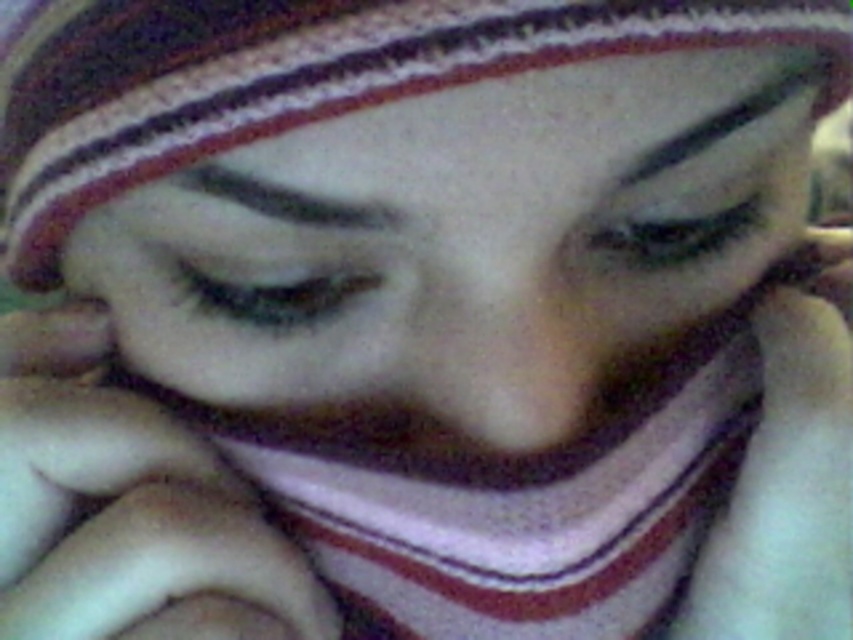
What do you see at coordinates (306, 77) in the screenshot? This screenshot has width=853, height=640. I see `white knitted hat at upper center` at bounding box center [306, 77].

Does point (602, 3) lie in front of point (712, 612)?

Yes, point (602, 3) is closer to viewer.

Who is more forward, (x=265, y=106) or (x=792, y=513)?

Point (x=265, y=106)

Image resolution: width=853 pixels, height=640 pixels. What are the coordinates of `white knitted hat at upper center` in the screenshot? It's located at (306, 77).

Is white knitted hat at upper center above white soft hand at center?

Yes.

Who is taller, white knitted hat at upper center or white soft hand at center?

white soft hand at center is taller.

Locate an element on the screen. white knitted hat at upper center is located at coordinates (306, 77).

This screenshot has height=640, width=853. What do you see at coordinates (463, 252) in the screenshot?
I see `matte white face at center` at bounding box center [463, 252].

Find the location of a particular element. The image size is (853, 640). matte white face at center is located at coordinates (463, 252).

Which is in front, point (520, 294) or point (73, 192)?

Point (520, 294) is in front.

The image size is (853, 640). What are the coordinates of `matte white face at center` in the screenshot? It's located at (463, 252).